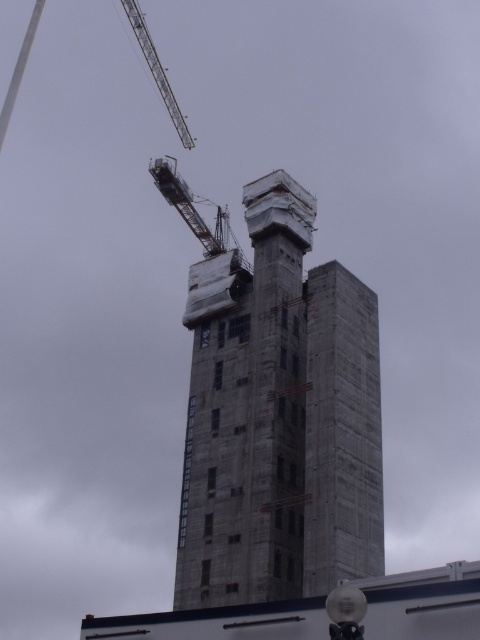
Between concrete at center and metallic gray crane at upper left, which one has more height?

With more height is metallic gray crane at upper left.

Who is lower down, concrete at center or metallic gray crane at upper left?

concrete at center

At what (x,y) coordinates should I click in order to perform the action: click on concrete at center. Please return your answer as a coordinate pair (x, y). The width and height of the screenshot is (480, 640). Looking at the image, I should click on (278, 417).

Which is more to the right, metallic gray crane at upper left or metallic gray crane at upper center?

metallic gray crane at upper center is more to the right.

Find the location of `metallic gray crane at upper left`. metallic gray crane at upper left is located at coordinates (156, 70).

Find the location of a particular element. This screenshot has height=640, width=480. metallic gray crane at upper left is located at coordinates (156, 70).

Find the location of `metallic gray crane at upper left`. metallic gray crane at upper left is located at coordinates (156, 70).

Does concrete at center come in front of metallic gray crane at upper center?

Yes, it is in front of metallic gray crane at upper center.

Is concrete at center thinner than metallic gray crane at upper center?

In fact, concrete at center might be wider than metallic gray crane at upper center.

In order to click on concrete at center in this screenshot , I will do `click(278, 417)`.